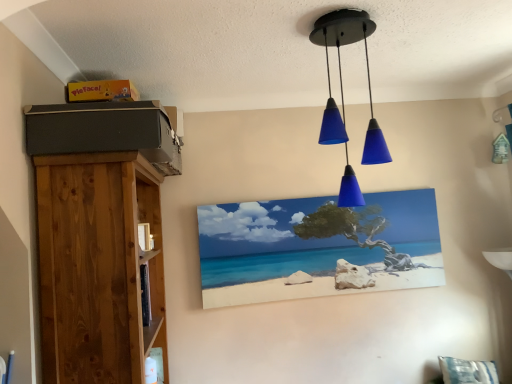
The width and height of the screenshot is (512, 384). I want to click on matte canvas painting at center, so 317,247.

The width and height of the screenshot is (512, 384). Find the location of `matte canvas painting at center`. matte canvas painting at center is located at coordinates pos(317,247).

Does point (208, 222) appear closer or farther from the camera than point (373, 25)?

Point (208, 222) appears to be farther away from the viewer than point (373, 25).

Can you confirm if matte canvas painting at center is taller than blue glass pendant lights at upper center?

No.

Is the depth of matte canvas painting at center greater than that of blue glass pendant lights at upper center?

Yes, the depth of matte canvas painting at center is greater than that of blue glass pendant lights at upper center.

Based on the photo, who is smaller, matte canvas painting at center or blue glass pendant lights at upper center?

matte canvas painting at center.

From a real-world perspective, who is located higher, natural wood bookshelf at left or matte canvas painting at center?

matte canvas painting at center is physically above.

Is natural wood bookshelf at left positioned behind matte canvas painting at center?

No, natural wood bookshelf at left is closer to the viewer.

Locate an element on the screen. picture frame lying on the right of natural wood bookshelf at left is located at coordinates (317, 247).

Can you tell me how much natural wood bookshelf at left and matte canvas painting at center differ in facing direction?

There is a 91.6-degree angle between the facing directions of natural wood bookshelf at left and matte canvas painting at center.

Between blue glass pendant lights at upper center and natural wood bookshelf at left, which one has more height?

natural wood bookshelf at left.

From the image's perspective, which is below, blue glass pendant lights at upper center or natural wood bookshelf at left?

natural wood bookshelf at left, from the image's perspective.

From a real-world perspective, is blue glass pendant lights at upper center below natural wood bookshelf at left?

No, from a real-world perspective, blue glass pendant lights at upper center is not under natural wood bookshelf at left.

From the image's perspective, relative to blue glass pendant lights at upper center, is natural wood bookshelf at left above or below?

Clearly, from the image's perspective, natural wood bookshelf at left is below blue glass pendant lights at upper center.

Considering the points (96, 332) and (371, 153), which point is behind, point (96, 332) or point (371, 153)?

The point (371, 153) is more distant.

Which of these two, natural wood bookshelf at left or blue glass pendant lights at upper center, is thinner?

With smaller width is blue glass pendant lights at upper center.

Image resolution: width=512 pixels, height=384 pixels. In the image, there is a blue glass pendant lights at upper center. Find the location of `furniture below it (from a real-world perspective)`. furniture below it (from a real-world perspective) is located at coordinates (97, 266).

From the image's perspective, is blue glass pendant lights at upper center located beneath matte canvas painting at center?

No, from the image's perspective, blue glass pendant lights at upper center is not beneath matte canvas painting at center.

Considering the relative positions of blue glass pendant lights at upper center and matte canvas painting at center in the image provided, is blue glass pendant lights at upper center to the right of matte canvas painting at center from the viewer's perspective?

No, blue glass pendant lights at upper center is not to the right of matte canvas painting at center.

From the picture: From a real-world perspective, is matte canvas painting at center located beneath natural wood bookshelf at left?

Incorrect, from a real-world perspective, matte canvas painting at center is higher than natural wood bookshelf at left.

Consider the image. Is matte canvas painting at center with natural wood bookshelf at left?

There is a gap between matte canvas painting at center and natural wood bookshelf at left.

Is the depth of matte canvas painting at center greater than that of natural wood bookshelf at left?

Yes.

The image size is (512, 384). What are the coordinates of `picture frame that appears below the blue glass pendant lights at upper center (from a real-world perspective)` in the screenshot? It's located at (317, 247).

You are a GUI agent. You are given a task and a screenshot of the screen. Output one action in this format:
    pyautogui.click(x=<x>, y=<y>)
    Task: Click on the furniture that appears on the left of matte canvas painting at center
    
    Given the screenshot: What is the action you would take?
    pyautogui.click(x=97, y=266)

Considering their positions, is blue glass pendant lights at upper center positioned closer to matte canvas painting at center than natural wood bookshelf at left?

blue glass pendant lights at upper center is closer to matte canvas painting at center.

From the image, which object appears to be nearer to natural wood bookshelf at left, blue glass pendant lights at upper center or matte canvas painting at center?

Among the two, blue glass pendant lights at upper center is located nearer to natural wood bookshelf at left.

From the image, which object appears to be farther from natural wood bookshelf at left, matte canvas painting at center or blue glass pendant lights at upper center?

matte canvas painting at center is further to natural wood bookshelf at left.

Based on the photo, from the image, which object appears to be farther from matte canvas painting at center, natural wood bookshelf at left or blue glass pendant lights at upper center?

natural wood bookshelf at left is further to matte canvas painting at center.

When comparing their distances from blue glass pendant lights at upper center, does matte canvas painting at center or natural wood bookshelf at left seem closer?

matte canvas painting at center.

Estimate the real-world distances between objects in this image. Which object is further from blue glass pendant lights at upper center, natural wood bookshelf at left or matte canvas painting at center?

Among the two, natural wood bookshelf at left is located further to blue glass pendant lights at upper center.

At what (x,y) coordinates should I click in order to perform the action: click on lamp between natural wood bookshelf at left and matte canvas painting at center from left to right. Please return your answer as a coordinate pair (x, y). This screenshot has height=384, width=512. Looking at the image, I should click on click(x=343, y=99).